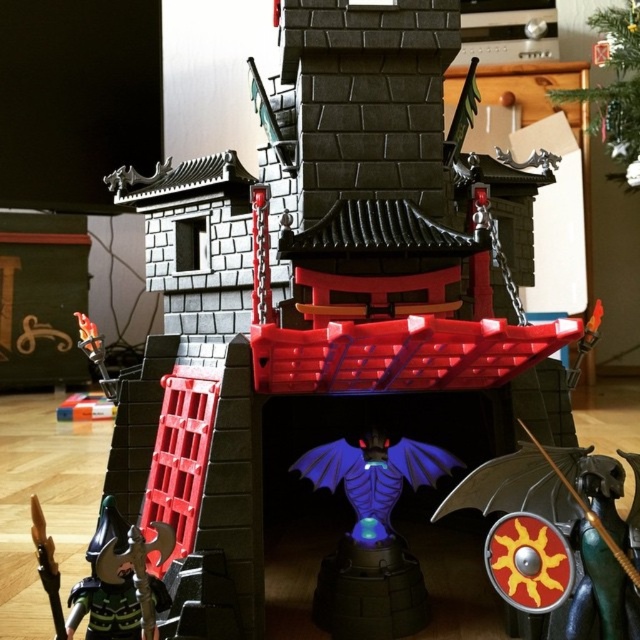
Is blue translucent dragon at center closer to the viewer compared to black plastic axe at lower left?

That is False.

Measure the distance from blue translucent dragon at center to black plastic axe at lower left.

The distance of blue translucent dragon at center from black plastic axe at lower left is 12.53 inches.

Find the location of a particular element. blue translucent dragon at center is located at coordinates (371, 536).

Which of these two, shiny metallic shield at center or black plastic axe at lower left, stands shorter?

Standing shorter between the two is black plastic axe at lower left.

Is point (616, 480) behind point (51, 588)?

That is True.

Where is `shiny metallic shield at center`? The height and width of the screenshot is (640, 640). shiny metallic shield at center is located at coordinates click(x=557, y=538).

Between shiny metallic shield at center and blue translucent dragon at center, which one has less height?

With less height is shiny metallic shield at center.

Is point (545, 504) positioned before point (387, 544)?

Yes, point (545, 504) is in front of point (387, 544).

The width and height of the screenshot is (640, 640). Find the location of `shiny metallic shield at center`. shiny metallic shield at center is located at coordinates (557, 538).

I want to click on shiny metallic shield at center, so click(x=557, y=538).